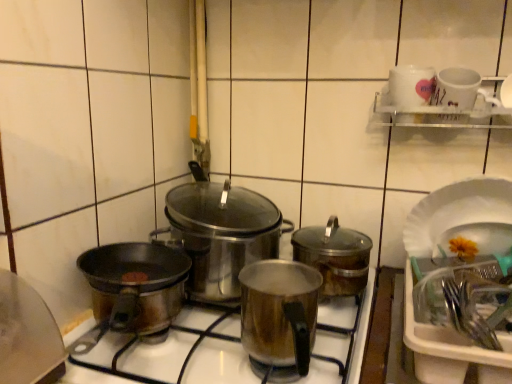
Question: In which direction should I rotate to look at stainless steel pot at center, the first kitchen appliance from the left?

Choices:
 (A) right
 (B) left

Answer: (B)

Question: Can shiny metallic pot at center, which is the 2th kitchen appliance in right-to-left order, be found inside shiny metallic pot at center, which is counted as the 3th kitchen appliance, starting from the left?

Choices:
 (A) no
 (B) yes

Answer: (A)

Question: Is shiny metallic pot at center, which is the first kitchen appliance in right-to-left order, not close to shiny metallic pot at center, which is the 2th kitchen appliance in right-to-left order?

Choices:
 (A) yes
 (B) no

Answer: (B)

Question: From a real-world perspective, does shiny metallic pot at center, which is counted as the 3th kitchen appliance, starting from the left, stand above shiny metallic pot at center, which is the 2th kitchen appliance in right-to-left order?

Choices:
 (A) no
 (B) yes

Answer: (B)

Question: Can you confirm if shiny metallic pot at center, which is counted as the 3th kitchen appliance, starting from the left, is thinner than shiny metallic pot at center, which is the 2th kitchen appliance in right-to-left order?

Choices:
 (A) yes
 (B) no

Answer: (B)

Question: Is shiny metallic pot at center, which is the first kitchen appliance in right-to-left order, wider than shiny metallic pot at center, positioned as the second kitchen appliance in left-to-right order?

Choices:
 (A) yes
 (B) no

Answer: (A)

Question: Can you confirm if shiny metallic pot at center, which is the first kitchen appliance in right-to-left order, is shorter than shiny metallic pot at center, which is the 2th kitchen appliance in right-to-left order?

Choices:
 (A) yes
 (B) no

Answer: (A)

Question: Is white glossy mug at upper right far away from white paper plate at right?

Choices:
 (A) yes
 (B) no

Answer: (B)

Question: From the image's perspective, is white glossy mug at upper right on white paper plate at right?

Choices:
 (A) yes
 (B) no

Answer: (A)

Question: Is white glossy mug at upper right bigger than white paper plate at right?

Choices:
 (A) no
 (B) yes

Answer: (A)

Question: Does white glossy mug at upper right have a lesser width compared to white paper plate at right?

Choices:
 (A) yes
 (B) no

Answer: (A)

Question: Considering the relative sizes of white glossy mug at upper right and white paper plate at right in the image provided, is white glossy mug at upper right wider than white paper plate at right?

Choices:
 (A) yes
 (B) no

Answer: (B)

Question: Is white glossy mug at upper right facing away from white paper plate at right?

Choices:
 (A) yes
 (B) no

Answer: (B)

Question: Is satin silver pot at center facing towards stainless steel pot at center, the 3th kitchen appliance positioned from the right?

Choices:
 (A) yes
 (B) no

Answer: (B)